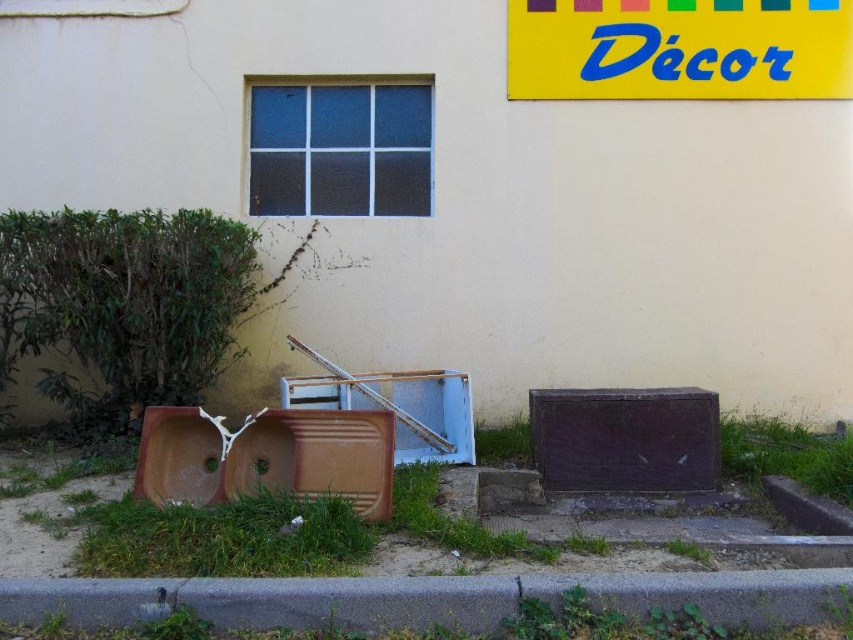
You are a delivery person trying to park your 3.5 meter long truck in front of the gray asphalt curb at lower center. There is a yellow plastic sign at upper center nearby. Based on the scene, can your truck fit without hitting the sign?

The gray asphalt curb at lower center and yellow plastic sign at upper center are 4.00 meters apart. Since the truck is 3.5 meters long, it can fit between them without hitting the sign.

In the scene shown: You are standing at the entrance of the building and want to walk to the gray asphalt curb at lower center. According to the scene description, where should you head to reach it?

The gray asphalt curb at lower center is located at point (x=426, y=598), so you should head towards the lower center area of the scene to reach it.